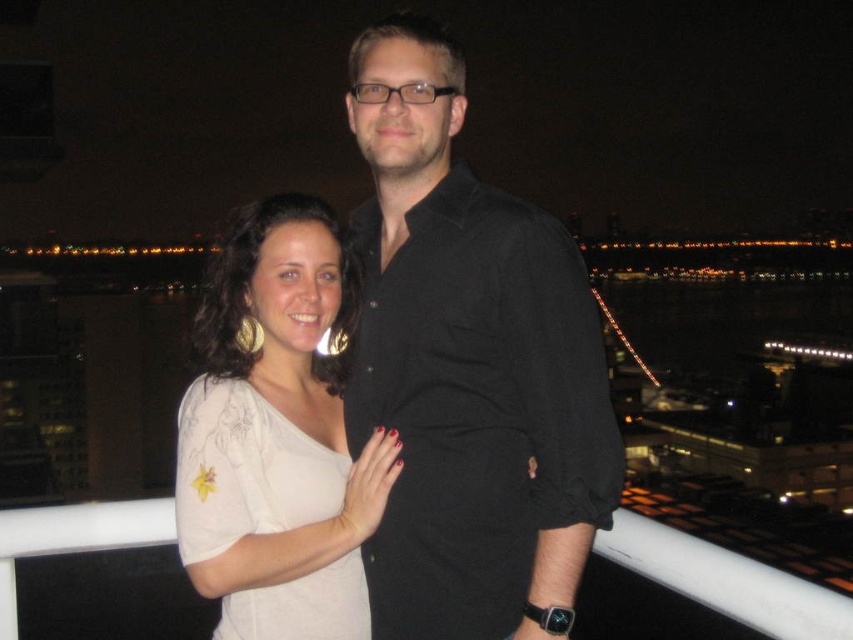
Who is positioned more to the left, black cotton shirt at center or white matte blouse at center?

white matte blouse at center

Can you confirm if black cotton shirt at center is positioned below white matte blouse at center?

Actually, black cotton shirt at center is above white matte blouse at center.

Is point (502, 570) farther from camera compared to point (299, 193)?

No, (502, 570) is in front of (299, 193).

Locate an element on the screen. This screenshot has width=853, height=640. black cotton shirt at center is located at coordinates (469, 368).